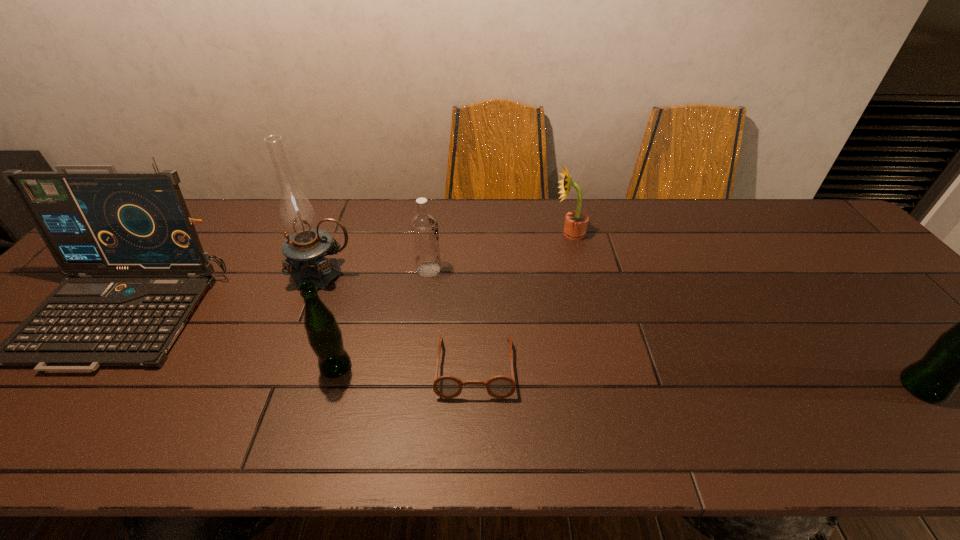
Where is `vacant space located on the left of the right beer bottle`? The image size is (960, 540). vacant space located on the left of the right beer bottle is located at coordinates (878, 387).

Where is `free point located on the face of the sixth object from left to right`? Image resolution: width=960 pixels, height=540 pixels. free point located on the face of the sixth object from left to right is located at coordinates (488, 233).

Image resolution: width=960 pixels, height=540 pixels. I want to click on vacant position located on the face of the sixth object from left to right, so click(534, 233).

Locate an element on the screen. free location located on the face of the sixth object from left to right is located at coordinates (504, 233).

The image size is (960, 540). I want to click on free space located 0.070m on the front of the tallest object, so click(x=310, y=309).

Locate an element on the screen. free point located 0.380m on the front label of the fourth object from right to left is located at coordinates (578, 269).

Find the location of a particular element. This screenshot has height=540, width=960. object located in the far edge section of the desktop is located at coordinates (576, 222).

Find the location of a particular element. spectacles located in the near edge section of the desktop is located at coordinates (447, 386).

Locate an element on the screen. Image resolution: width=960 pixels, height=540 pixels. object located in the right edge section of the desktop is located at coordinates click(959, 357).

Where is `object that is at the near right corner`? This screenshot has height=540, width=960. object that is at the near right corner is located at coordinates (959, 357).